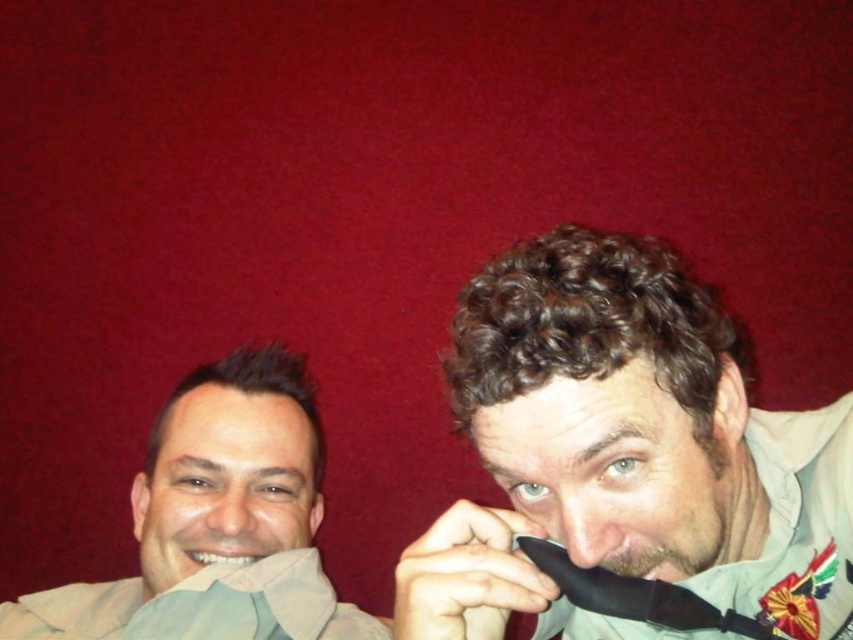
You are a fashion designer observing the two individuals in the image. You need to determine which item has a greater width for a design project. Which is wider between the matte beige shirt at left and the matte skin nose at center?

The matte beige shirt at left is wider than the matte skin nose at center, as stated in the description that the matte beige shirt at left surpasses the width of the matte skin nose at center.

You are a photographer adjusting your camera settings. You notice the dry matte nose at center and the white glossy teeth at lower left in your frame. Which object should you focus on to ensure the other is also in sharp focus?

Since the dry matte nose at center is in front of the white glossy teeth at lower left, focusing on the dry matte nose at center will keep both in sharp focus because it is closer to the camera.

You are a photographer setting up for a group photo. You see the matte beige shirt at left and the dry matte nose at center. Which object is located lower in the image?

The matte beige shirt at left is positioned under the dry matte nose at center, so the matte beige shirt at left is lower in the image.